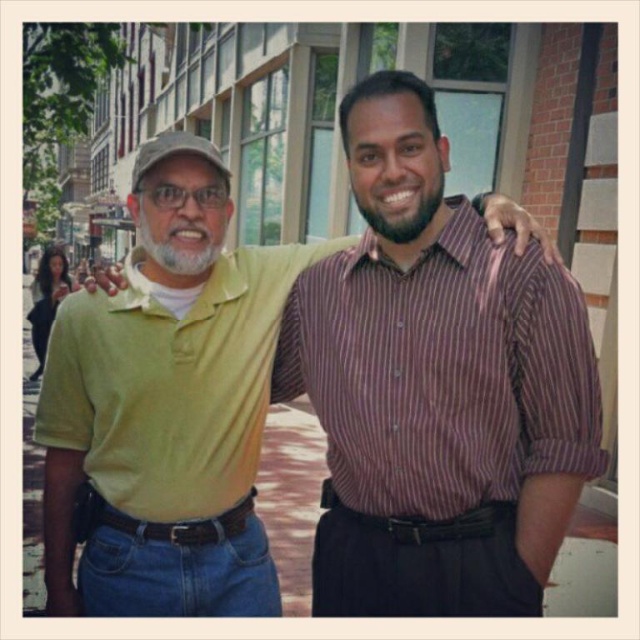
Identify the location of green cotton polo shirt at center. The image size is (640, 640). (168, 406).

Can you confirm if green cotton polo shirt at center is positioned to the right of purple striped shirt at right?

No, green cotton polo shirt at center is not to the right of purple striped shirt at right.

The image size is (640, 640). What do you see at coordinates (168, 406) in the screenshot? I see `green cotton polo shirt at center` at bounding box center [168, 406].

This screenshot has width=640, height=640. Identify the location of green cotton polo shirt at center. click(168, 406).